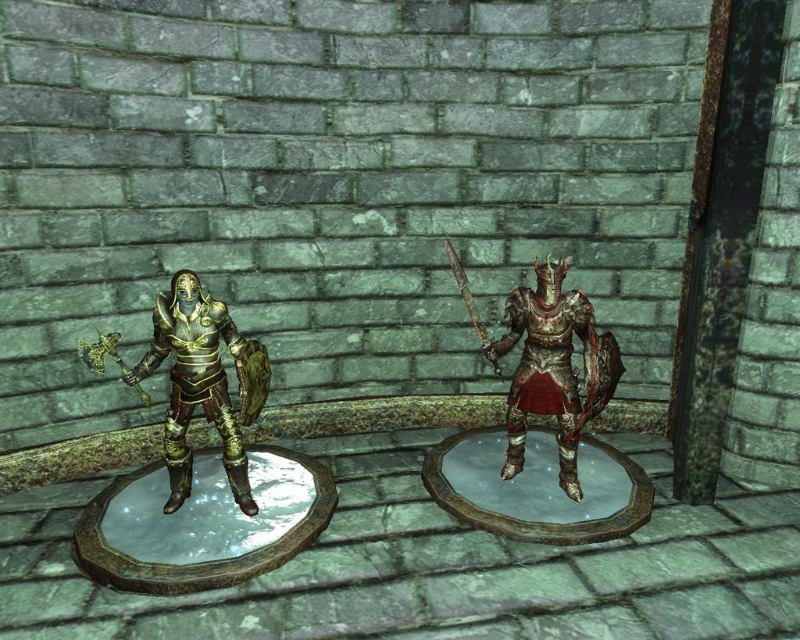
Question: Does gold plated armor at left have a smaller size compared to polished bronze armor at center?

Choices:
 (A) no
 (B) yes

Answer: (B)

Question: Which point is closer to the camera?

Choices:
 (A) (558, 352)
 (B) (246, 390)

Answer: (B)

Question: From the image, what is the correct spatial relationship of gold plated armor at left in relation to polished bronze armor at center?

Choices:
 (A) above
 (B) below

Answer: (B)

Question: In this image, where is gold plated armor at left located relative to polished bronze armor at center?

Choices:
 (A) left
 (B) right

Answer: (A)